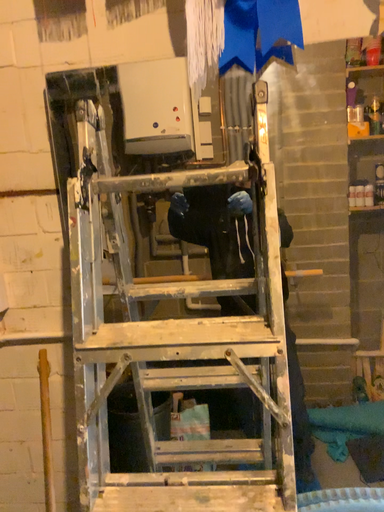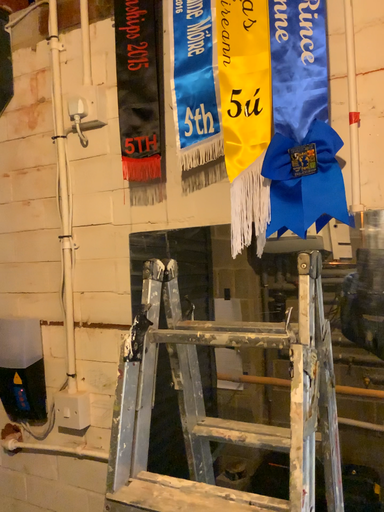
Question: Which way did the camera rotate in the video?

Choices:
 (A) rotated upward
 (B) rotated downward

Answer: (A)